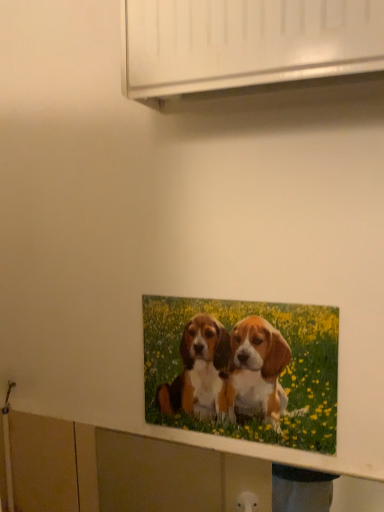
The image size is (384, 512). What are the coordinates of `printed canvas puppies at center` in the screenshot? It's located at (281, 376).

What do you see at coordinates (281, 376) in the screenshot?
I see `printed canvas puppies at center` at bounding box center [281, 376].

Where is `printed canvas puppies at center`? Image resolution: width=384 pixels, height=512 pixels. printed canvas puppies at center is located at coordinates (281, 376).